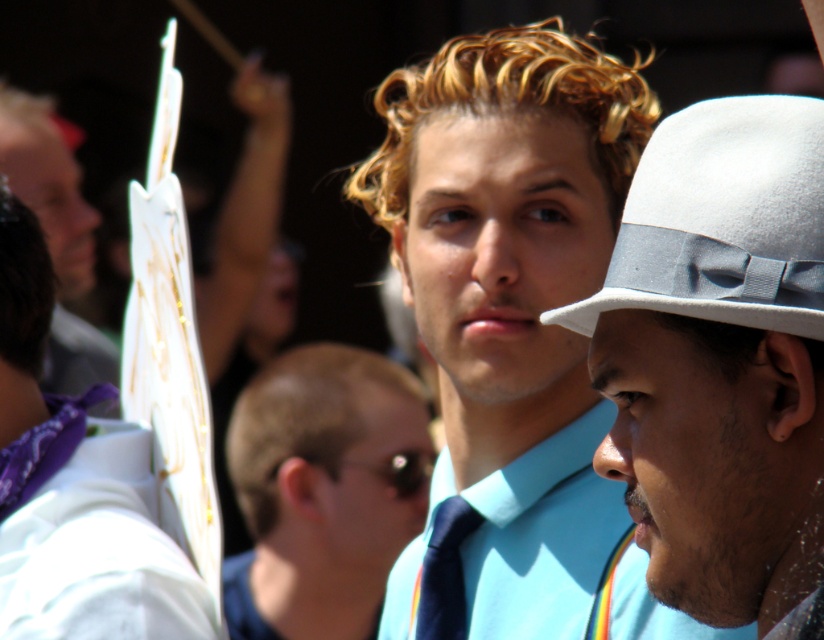
You are a photographer standing between the white felt fedora at right and the matte white sign at left. You want to take a photo that includes both objects in the frame. Given that your camera has a maximum angle of view of 120 degrees, can you capture both objects without moving? Explain your reasoning.

The white felt fedora at right and matte white sign at left are 13.14 feet apart. To determine if they can fit in a 120 degree angle, we need to know the distance from the camera to the objects. Without this information, it is impossible to calculate the required angle. Therefore, the photographer cannot determine if both objects can be captured without moving based solely on the given distance between them.

You are standing in the crowd at the event, and you see a white paper sign at upper left. Where is the point at coordinates [75,486] located?

The point at coordinates [75,486] is located on the white paper sign at upper left.

You are a pedestrian standing in the crowd and want to read both the white paper sign at upper left and the matte white sign at left. Which sign can you see more clearly?

The white paper sign at upper left is in front of the matte white sign at left, so you can see the white paper sign at upper left more clearly.